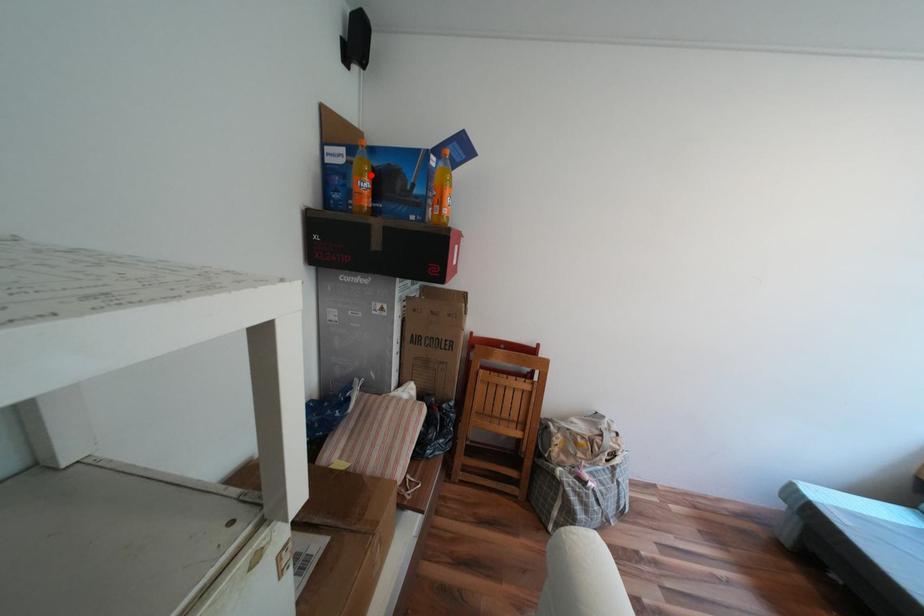
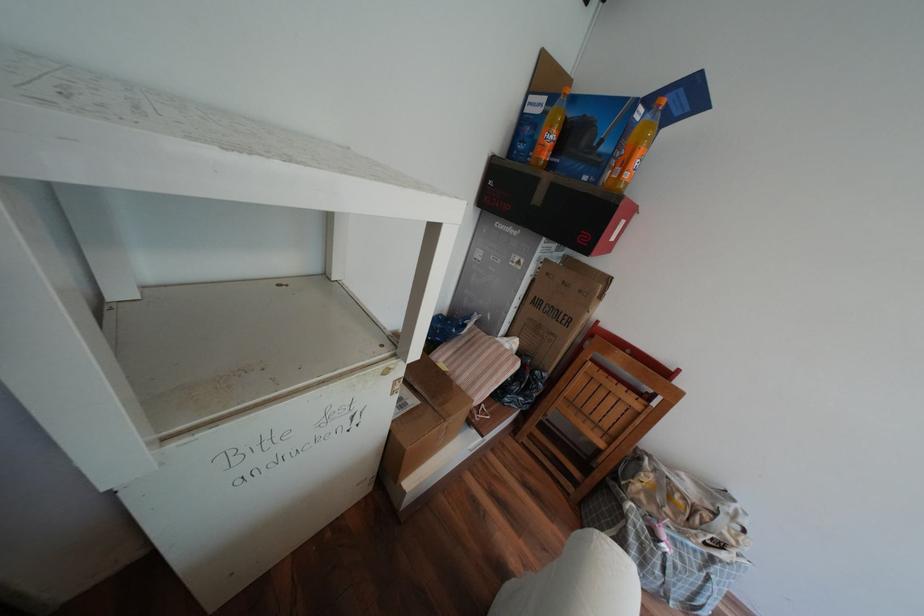
In the second image, find the point that corresponds to the highlighted location in the first image.

(561, 127)